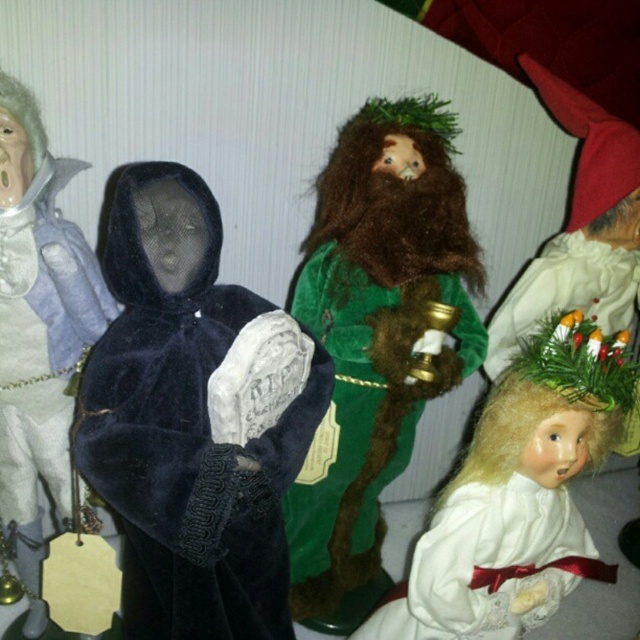
Question: Which point is closer to the camera?

Choices:
 (A) white matte doll at lower right
 (B) velvet black cape at center
 (C) white satin dress at lower right
 (D) green velvet figure at center

Answer: (B)

Question: Among these points, which one is farthest from the camera?

Choices:
 (A) (404, 440)
 (B) (481, 604)

Answer: (A)

Question: From the image, what is the correct spatial relationship of velvet black cape at center in relation to velvet black cloak at left?

Choices:
 (A) left
 (B) right

Answer: (B)

Question: Does green velvet figure at center come in front of white satin dress at lower right?

Choices:
 (A) no
 (B) yes

Answer: (B)

Question: Can you confirm if green velvet figure at center is positioned to the right of white matte doll at lower right?

Choices:
 (A) yes
 (B) no

Answer: (B)

Question: Which of the following is the closest to the observer?

Choices:
 (A) velvet black cape at center
 (B) velvet black cloak at left
 (C) green velvet figure at center
 (D) white satin dress at lower right

Answer: (A)